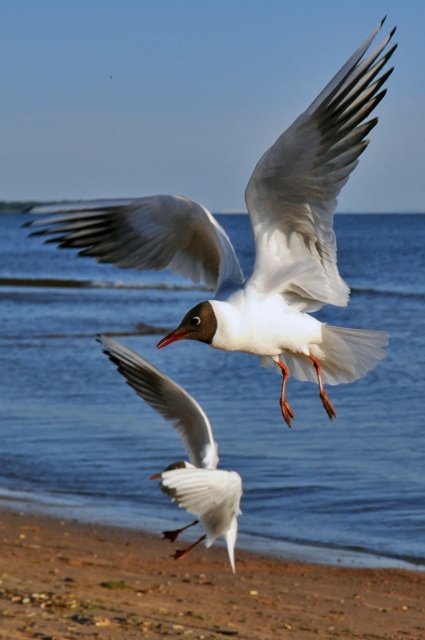
You are a drone operator trying to capture the seagulls flying over the beach. Your drone is currently hovering at the coordinates given for the blue water at center. To get a better shot of the seagulls, should you move your drone north or south from its current position?

The blue water at center is located at coordinates point (217, 403). Since the seagulls are flying in the foreground over the beach, which is likely north of the water, you should move the drone north to capture them better.